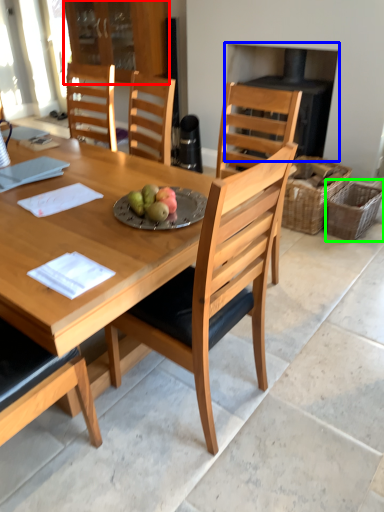
Question: Estimate the real-world distances between objects in this image. Which object is farther from cabinetry (highlighted by a red box), fireplace (highlighted by a blue box) or picnic basket (highlighted by a green box)?

Choices:
 (A) fireplace
 (B) picnic basket

Answer: (B)